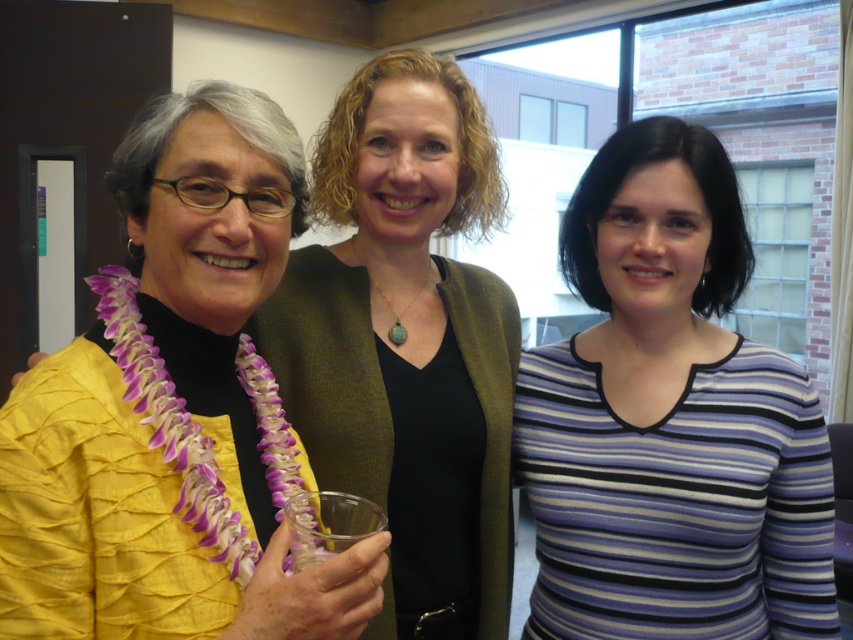
Does striped cotton shirt at center have a greater height compared to yellow pleated blouse at left?

Incorrect, striped cotton shirt at center's height is not larger of yellow pleated blouse at left's.

Is striped cotton shirt at center bigger than yellow pleated blouse at left?

Incorrect, striped cotton shirt at center is not larger than yellow pleated blouse at left.

You are a GUI agent. You are given a task and a screenshot of the screen. Output one action in this format:
    pyautogui.click(x=<x>, y=<y>)
    Task: Click on the striped cotton shirt at center
    
    Given the screenshot: What is the action you would take?
    pyautogui.click(x=669, y=419)

Identify the location of striped cotton shirt at center. The height and width of the screenshot is (640, 853). (669, 419).